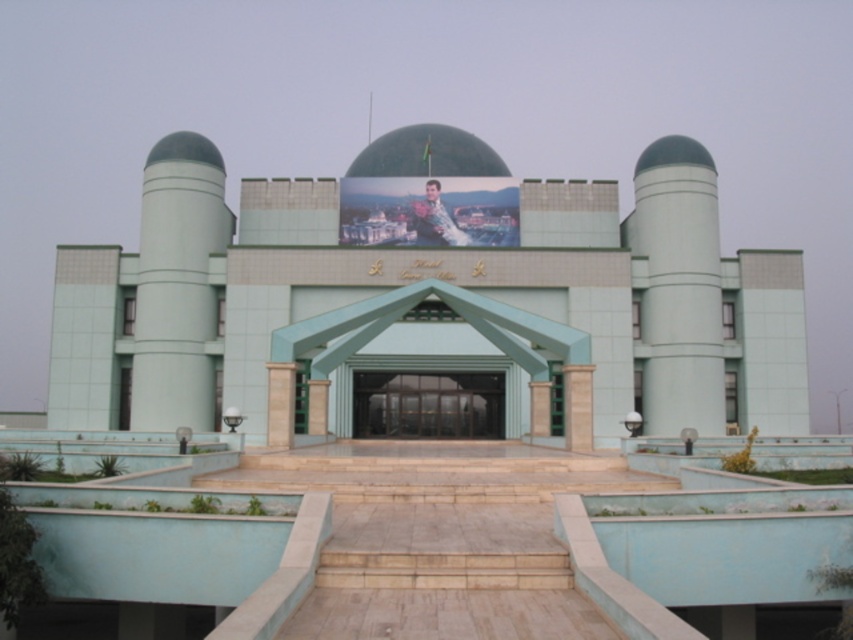
Question: Which point is farther to the camera?

Choices:
 (A) (213, 321)
 (B) (572, 308)
 (C) (430, 417)

Answer: (A)

Question: Which of the following is the farthest from the observer?

Choices:
 (A) light green concrete pillar at left
 (B) light green stone building at center

Answer: (A)

Question: In this image, where is light green concrete pillar at left located relative to green concrete pillar at right?

Choices:
 (A) above
 (B) below

Answer: (A)

Question: Can you confirm if green concrete pillar at right is bigger than green glass doors at center?

Choices:
 (A) yes
 (B) no

Answer: (A)

Question: Can you confirm if light green stone building at center is bigger than green glass doors at center?

Choices:
 (A) no
 (B) yes

Answer: (B)

Question: Among these points, which one is farthest from the camera?

Choices:
 (A) (401, 198)
 (B) (138, 376)

Answer: (A)